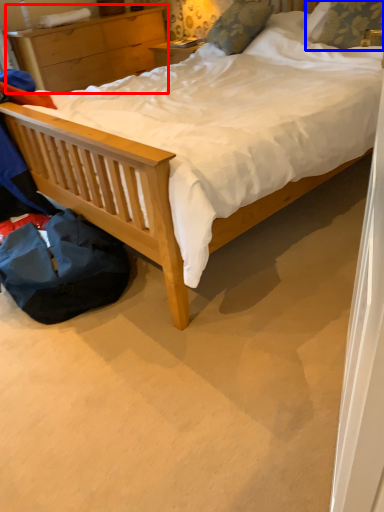
Question: Among these objects, which one is nearest to the camera, nightstand (highlighted by a red box) or pillow (highlighted by a blue box)?

Choices:
 (A) nightstand
 (B) pillow

Answer: (B)